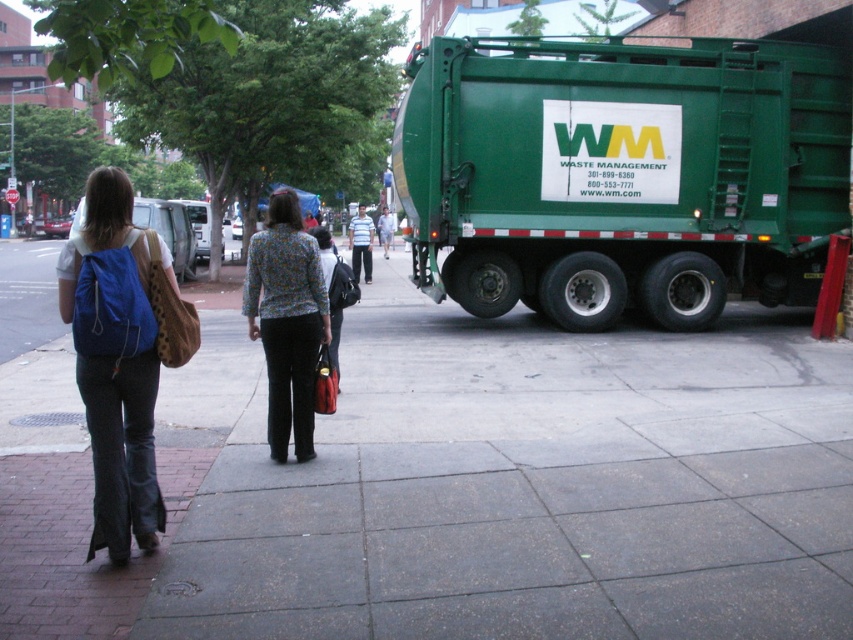
Question: Which of the following is the farthest from the observer?

Choices:
 (A) (387, 236)
 (B) (252, 260)
 (C) (128, 317)
 (D) (373, 227)

Answer: (A)

Question: Among these points, which one is nearest to the camera?

Choices:
 (A) (463, 250)
 (B) (339, 310)
 (C) (132, 461)

Answer: (C)

Question: Does blue fabric backpack at left have a lesser width compared to floral-patterned blouse at center?

Choices:
 (A) no
 (B) yes

Answer: (A)

Question: Based on their relative distances, which object is farther from the light blue denim jeans at center?

Choices:
 (A) patterned fabric purse at center
 (B) striped cotton shirt at center
 (C) blue fabric backpack at left
 (D) floral-patterned blouse at center

Answer: (D)

Question: Does blue fabric backpack at left appear on the right side of light blue denim jeans at center?

Choices:
 (A) no
 (B) yes

Answer: (A)

Question: Is floral-patterned blouse at center to the right of light blue denim jeans at center from the viewer's perspective?

Choices:
 (A) no
 (B) yes

Answer: (B)